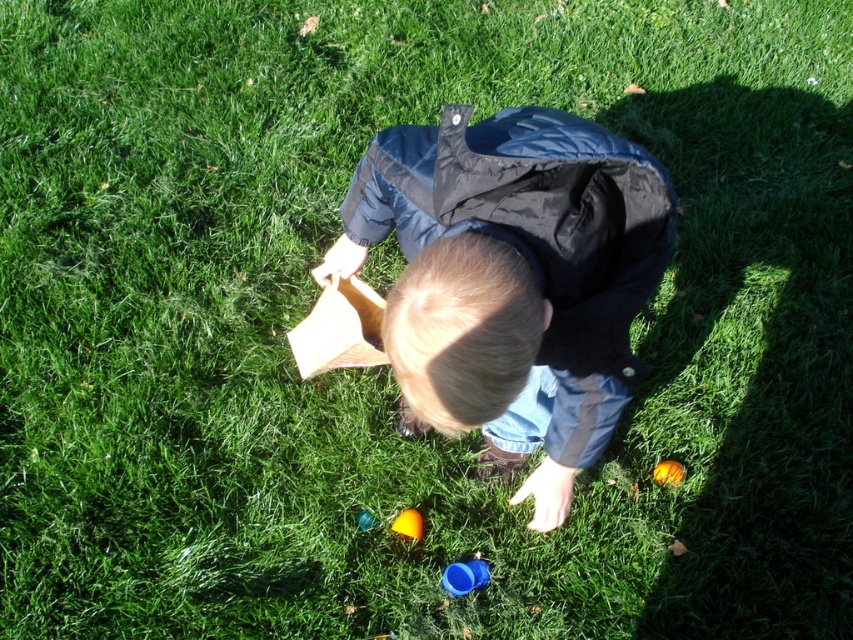
Question: Which of the following is the farthest from the observer?

Choices:
 (A) (672, 460)
 (B) (461, 584)
 (C) (361, 529)
 (D) (413, 532)

Answer: (A)

Question: Which is nearer to the orange rubber ball at lower center?

Choices:
 (A) blue plastic cup at lower center
 (B) shiny yellow toy at center
 (C) shiny blue plastic cup at center

Answer: (A)

Question: Is blue plastic cup at lower center thinner than orange rubber ball at lower center?

Choices:
 (A) yes
 (B) no

Answer: (B)

Question: Does orange rubber ball at lower center have a smaller size compared to shiny blue plastic cup at center?

Choices:
 (A) yes
 (B) no

Answer: (B)

Question: Which point is closer to the camera?

Choices:
 (A) blue plastic cup at lower center
 (B) shiny yellow toy at center

Answer: (A)

Question: Can you confirm if shiny yellow toy at center is thinner than shiny blue plastic cup at center?

Choices:
 (A) yes
 (B) no

Answer: (B)